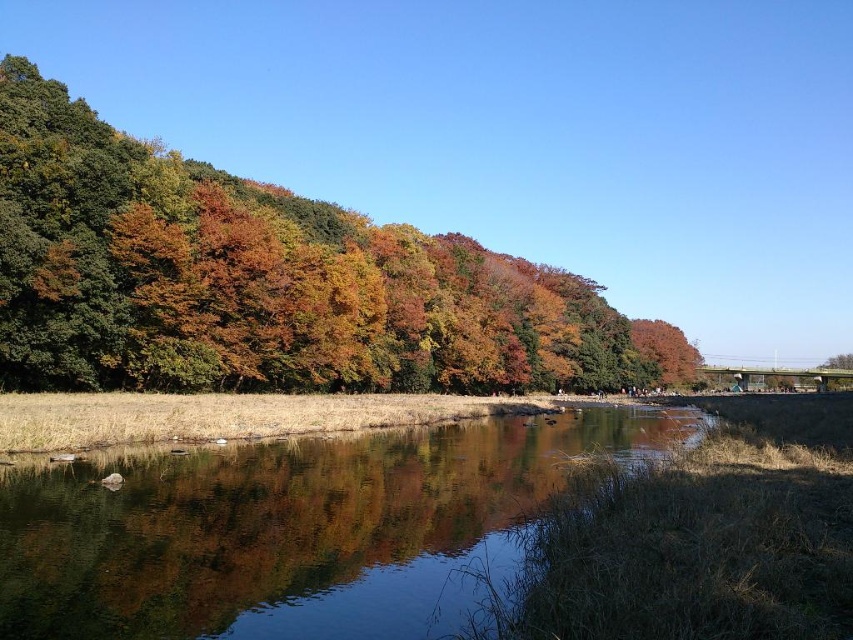
You are standing at the point closer to you in the scene. Which point are you at, point (376,390) or point (62,518)?

You are at point (376,390) because it is further to the viewer than point (62,518).

You are an artist planning to paint the autumn landscape. You want to ensure that the autumn leaves at upper left and the clear water at center are proportionally accurate. Based on the scene, which object should you depict as wider in your painting?

The autumn leaves at upper left should be depicted as wider than the clear water at center because the description states that the autumn leaves at upper left might be wider than clear water at center.